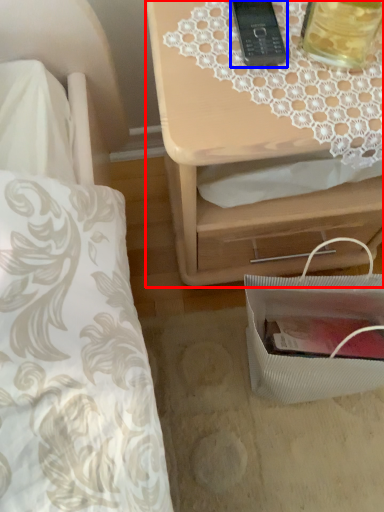
Question: Among these objects, which one is nearest to the camera, nightstand (highlighted by a red box) or gadget (highlighted by a blue box)?

Choices:
 (A) nightstand
 (B) gadget

Answer: (A)